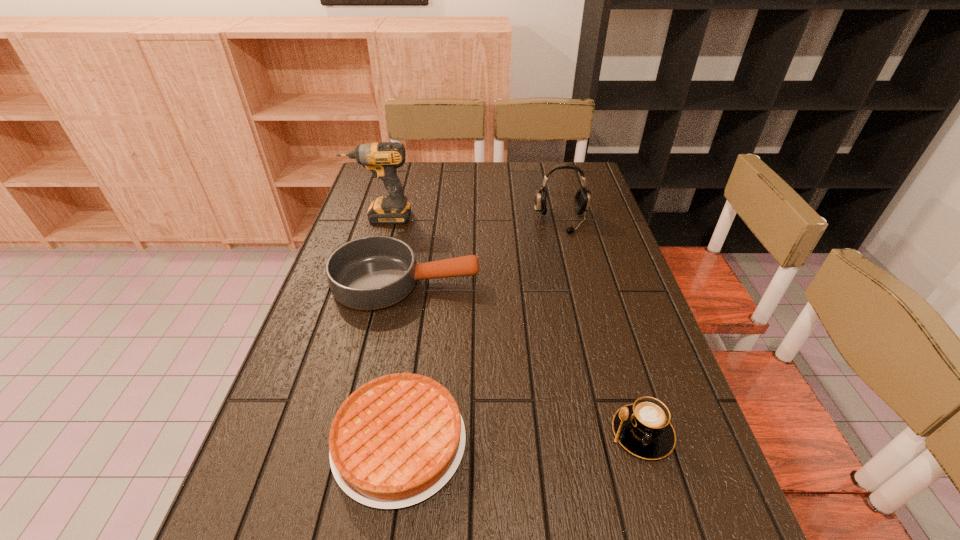
You are a GUI agent. You are given a task and a screenshot of the screen. Output one action in this format:
    pyautogui.click(x=<x>, y=<y>)
    Task: Click on the drill
    The image size is (960, 540).
    Given the screenshot: What is the action you would take?
    pyautogui.click(x=382, y=159)

Find the location of a particular element. This screenshot has height=540, width=960. headset is located at coordinates (582, 198).

This screenshot has width=960, height=540. In order to click on the third nearest object in this screenshot , I will do `click(369, 273)`.

The image size is (960, 540). I want to click on cappuccino, so click(644, 429).

Identify the location of pie. This screenshot has height=540, width=960. (398, 439).

At what (x,y) coordinates should I click in order to perform the action: click on free spot located with the microphone on the side of the headset. Please return your answer as a coordinate pair (x, y). The width and height of the screenshot is (960, 540). Looking at the image, I should click on (583, 308).

Where is `vacant space located 0.260m on the handle side of the third farthest object`? Image resolution: width=960 pixels, height=540 pixels. vacant space located 0.260m on the handle side of the third farthest object is located at coordinates (575, 283).

You are a GUI agent. You are given a task and a screenshot of the screen. Output one action in this format:
    pyautogui.click(x=<x>, y=<y>)
    Task: Click on the vacant space located on the back of the cappuccino
    
    Given the screenshot: What is the action you would take?
    pyautogui.click(x=613, y=336)

Image resolution: width=960 pixels, height=540 pixels. I want to click on vacant region located 0.210m on the back of the pie, so click(418, 316).

Find the location of `drill that is at the left edge`. drill that is at the left edge is located at coordinates (382, 159).